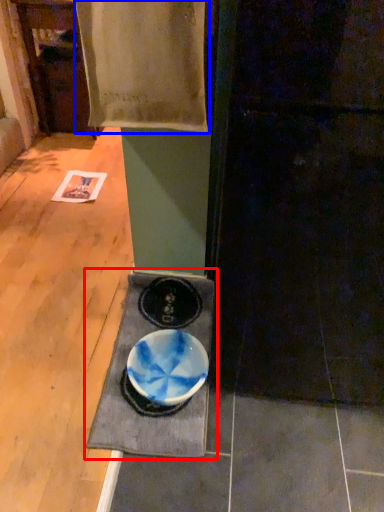
Question: Which object is closer to the camera taking this photo, table (highlighted by a red box) or blanket (highlighted by a blue box)?

Choices:
 (A) table
 (B) blanket

Answer: (B)